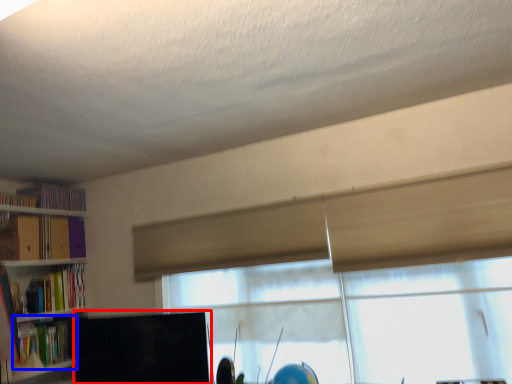
Question: Which of the following is the farthest to the observer, computer monitor (highlighted by a red box) or book (highlighted by a blue box)?

Choices:
 (A) computer monitor
 (B) book

Answer: (B)